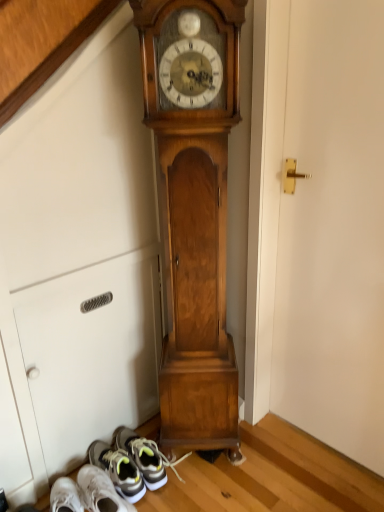
Question: From their relative heights in the image, would you say gray fabric sneaker at lower left is taller or shorter than white matte door at center right?

Choices:
 (A) short
 (B) tall

Answer: (A)

Question: From a real-world perspective, is gray fabric sneaker at lower left above or below white matte door at center right?

Choices:
 (A) above
 (B) below

Answer: (B)

Question: Estimate the real-world distances between objects in this image. Which object is closer to the gray fabric sneaker at lower left?

Choices:
 (A) wooden grandfather clock at center
 (B) white matte door at center right

Answer: (A)

Question: Which object is positioned closest to the gray fabric sneaker at lower left?

Choices:
 (A) wooden grandfather clock at center
 (B) white matte door at center right

Answer: (A)